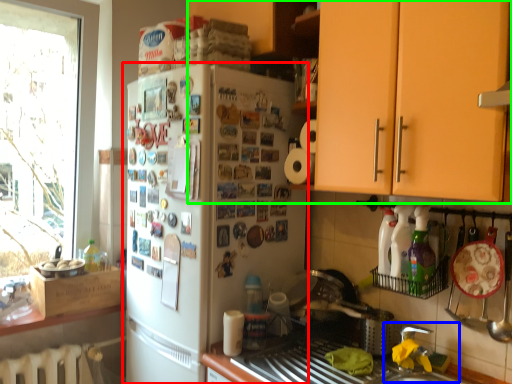
Question: Considering the real-world distances, which object is closest to refrigerator (highlighted by a red box)? sink (highlighted by a blue box) or cabinetry (highlighted by a green box).

Choices:
 (A) sink
 (B) cabinetry

Answer: (B)